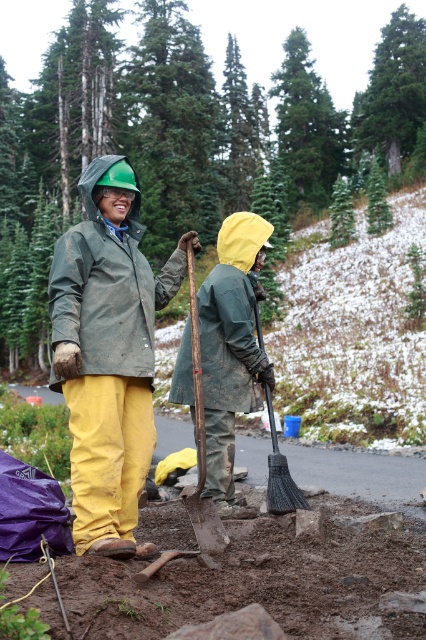
Question: Among these objects, which one is nearest to the camera?

Choices:
 (A) green matte raincoat at center
 (B) rusty metal shovel at center
 (C) black plastic shovel at lower center

Answer: (A)

Question: Can you confirm if green matte raincoat at center is wider than rusty metal shovel at center?

Choices:
 (A) no
 (B) yes

Answer: (B)

Question: Can you confirm if green matte raincoat at center is bigger than black plastic shovel at lower center?

Choices:
 (A) yes
 (B) no

Answer: (A)

Question: Can you confirm if rusty metal shovel at center is bigger than black plastic shovel at lower center?

Choices:
 (A) no
 (B) yes

Answer: (B)

Question: Which of these objects is positioned farthest from the green matte raincoat at center?

Choices:
 (A) yellow waterproof jacket at center
 (B) rusty metal shovel at center

Answer: (A)

Question: Which object appears closest to the camera in this image?

Choices:
 (A) rusty metal shovel at center
 (B) yellow waterproof jacket at center
 (C) green matte raincoat at center
 (D) black plastic shovel at lower center

Answer: (C)